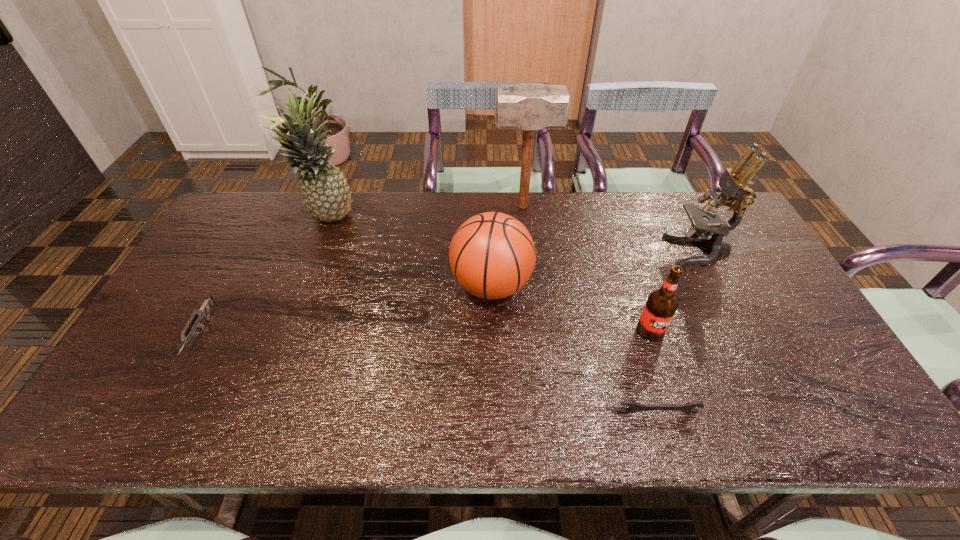
The image size is (960, 540). I want to click on the sixth object from right to left, so click(x=326, y=195).

The height and width of the screenshot is (540, 960). What are the coordinates of `mallet` in the screenshot? It's located at (528, 106).

I want to click on microscope, so click(736, 193).

The height and width of the screenshot is (540, 960). I want to click on basketball, so click(492, 255).

In order to click on root beer in this screenshot , I will do `click(661, 305)`.

At what (x,y) coordinates should I click in order to perform the action: click on gun. Please return your answer as a coordinate pair (x, y). Looking at the image, I should click on (203, 312).

At what (x,y) coordinates should I click in order to perform the action: click on the second shortest object. Please return your answer as a coordinate pair (x, y). Looking at the image, I should click on (203, 312).

This screenshot has width=960, height=540. I want to click on the shortest object, so tap(689, 408).

The width and height of the screenshot is (960, 540). Identify the location of the nearest object. (689, 408).

Image resolution: width=960 pixels, height=540 pixels. What are the coordinates of `free space located 0.140m on the right of the second object from left to right` in the screenshot? It's located at (396, 218).